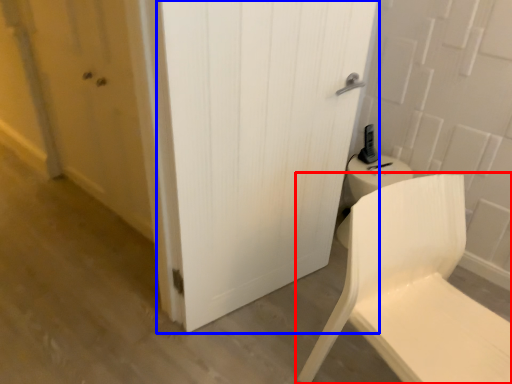
Question: Which point is closer to the camera, chair (highlighted by a red box) or door (highlighted by a blue box)?

Choices:
 (A) chair
 (B) door

Answer: (A)